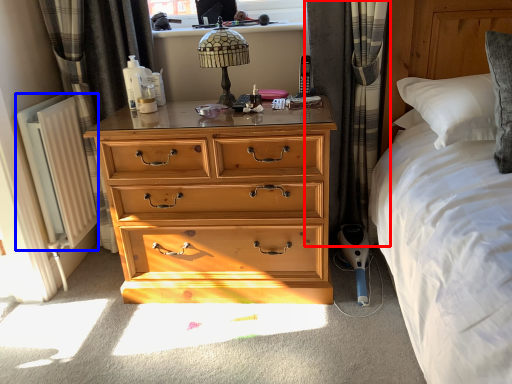
Question: Which object is further to the camera taking this photo, curtain (highlighted by a red box) or radiator (highlighted by a blue box)?

Choices:
 (A) curtain
 (B) radiator

Answer: (B)